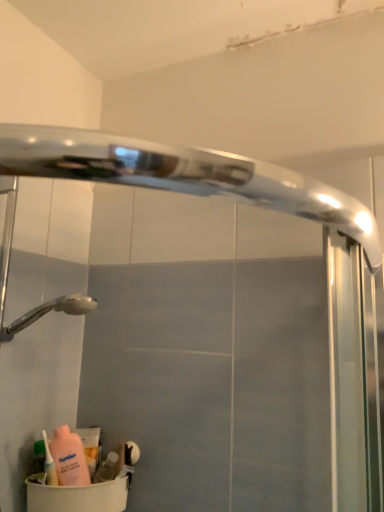
Question: From the image's perspective, is translucent plastic soap at lower left, acting as the 2th toiletry starting from the left, located beneath green matte bottle at lower left, which appears as the second toiletry when viewed from the right?

Choices:
 (A) no
 (B) yes

Answer: (B)

Question: Is translucent plastic soap at lower left, acting as the 2th toiletry starting from the left, touching green matte bottle at lower left, which appears as the second toiletry when viewed from the right?

Choices:
 (A) no
 (B) yes

Answer: (A)

Question: Is the depth of translucent plastic soap at lower left, acting as the 2th toiletry starting from the left, less than that of green matte bottle at lower left, which appears as the second toiletry when viewed from the right?

Choices:
 (A) yes
 (B) no

Answer: (B)

Question: Considering the relative sizes of translucent plastic soap at lower left, placed as the 1th toiletry when sorted from right to left, and green matte bottle at lower left, the first toiletry in the left-to-right sequence, in the image provided, is translucent plastic soap at lower left, placed as the 1th toiletry when sorted from right to left, thinner than green matte bottle at lower left, the first toiletry in the left-to-right sequence,?

Choices:
 (A) yes
 (B) no

Answer: (B)

Question: Can you confirm if translucent plastic soap at lower left, acting as the 2th toiletry starting from the left, is bigger than green matte bottle at lower left, the first toiletry in the left-to-right sequence?

Choices:
 (A) no
 (B) yes

Answer: (B)

Question: From the image's perspective, is translucent plastic soap at lower left, placed as the 1th toiletry when sorted from right to left, located above green matte bottle at lower left, which appears as the second toiletry when viewed from the right?

Choices:
 (A) no
 (B) yes

Answer: (A)

Question: Does beige plastic container at lower left have a smaller size compared to translucent plastic soap at lower left, placed as the 1th toiletry when sorted from right to left?

Choices:
 (A) yes
 (B) no

Answer: (B)

Question: Does beige plastic container at lower left have a greater width compared to translucent plastic soap at lower left, placed as the 1th toiletry when sorted from right to left?

Choices:
 (A) yes
 (B) no

Answer: (A)

Question: Can you see beige plastic container at lower left touching translucent plastic soap at lower left, acting as the 2th toiletry starting from the left?

Choices:
 (A) no
 (B) yes

Answer: (B)

Question: From the image's perspective, does beige plastic container at lower left appear higher than translucent plastic soap at lower left, acting as the 2th toiletry starting from the left?

Choices:
 (A) no
 (B) yes

Answer: (A)

Question: Is beige plastic container at lower left oriented towards translucent plastic soap at lower left, acting as the 2th toiletry starting from the left?

Choices:
 (A) no
 (B) yes

Answer: (A)

Question: Is beige plastic container at lower left turned away from translucent plastic soap at lower left, acting as the 2th toiletry starting from the left?

Choices:
 (A) no
 (B) yes

Answer: (A)

Question: Is pink matte bottle at lower left, placed as the 2th cleaning product when sorted from right to left, shorter than matte pink lotion at lower left, acting as the 2th cleaning product starting from the front?

Choices:
 (A) no
 (B) yes

Answer: (A)